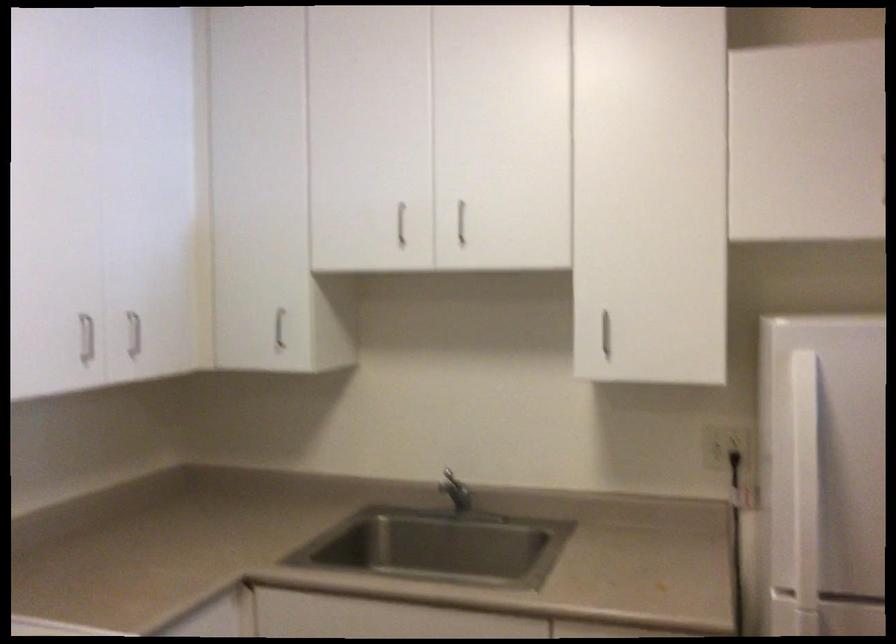
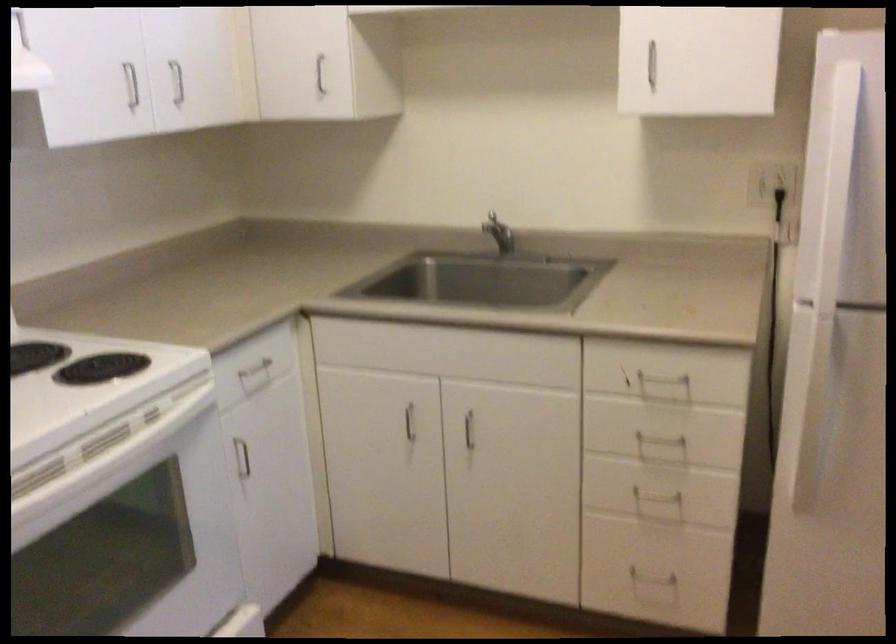
In the second image, find the point that corresponds to the point at 739,469 in the first image.

(779, 202)